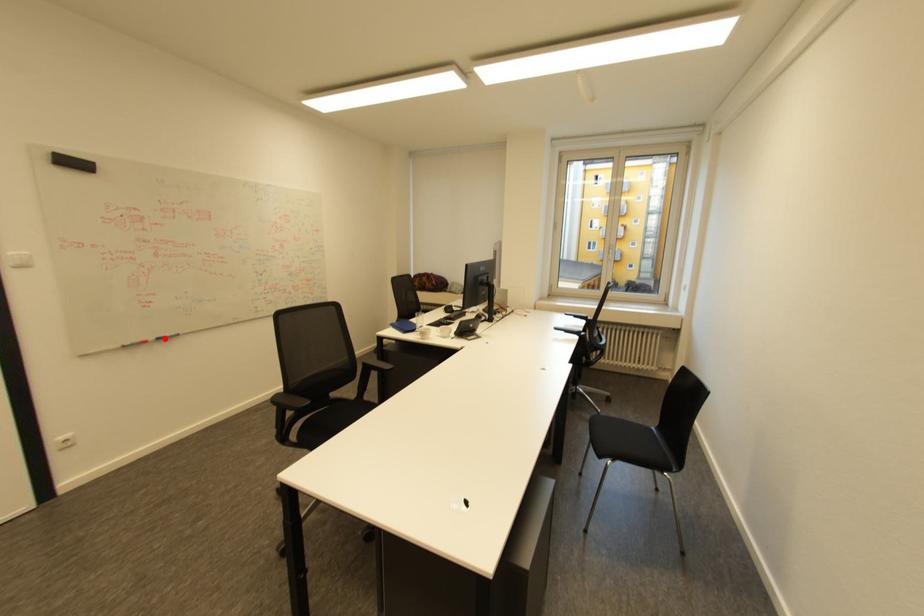
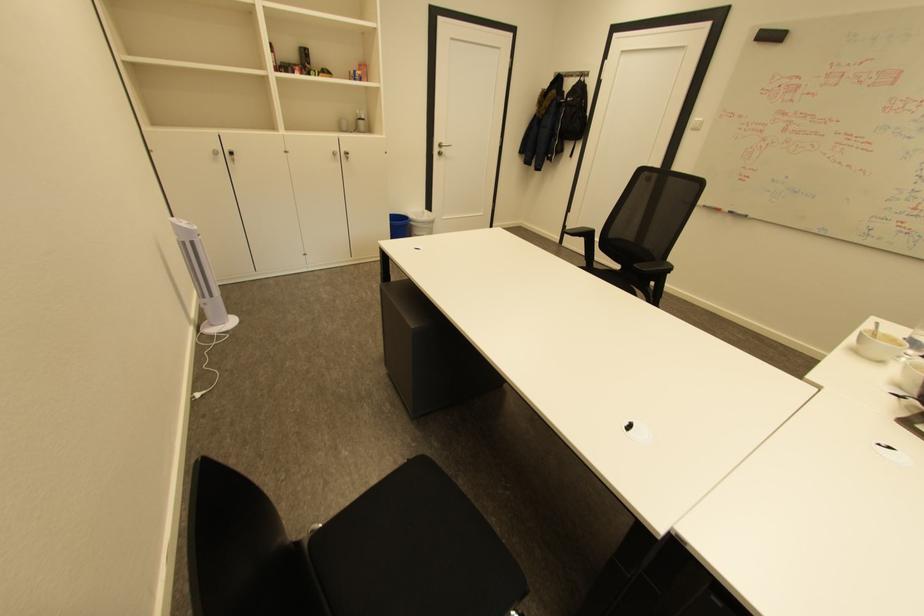
The point at the highlighted location is marked in the first image. Where is the corresponding point in the second image?

(737, 212)